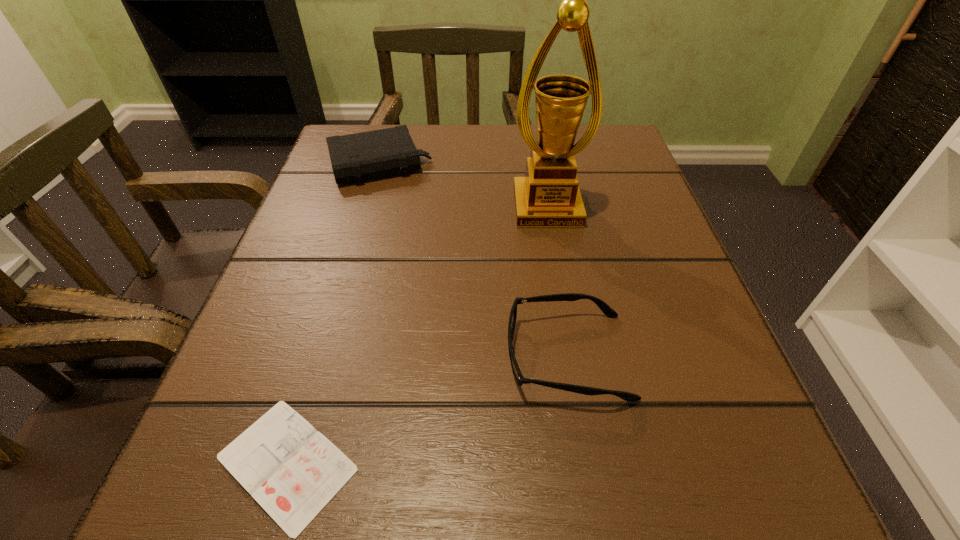
Locate an element on the screen. This screenshot has height=540, width=960. free region that satisfies the following two spatial constraints: 1. on the front-facing side of the award; 2. on the front-facing side of the spectacles is located at coordinates (573, 356).